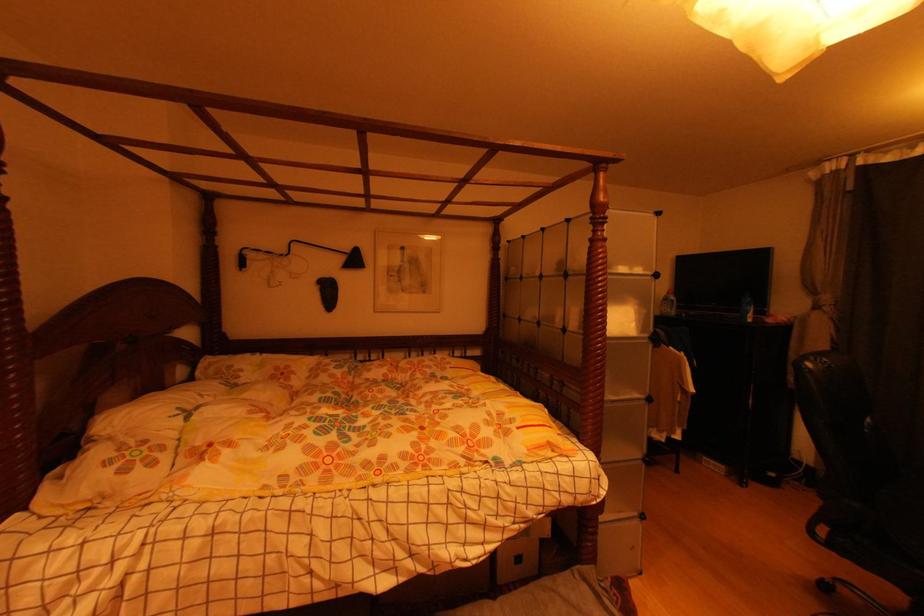
I want to click on black lamp head, so click(354, 259).